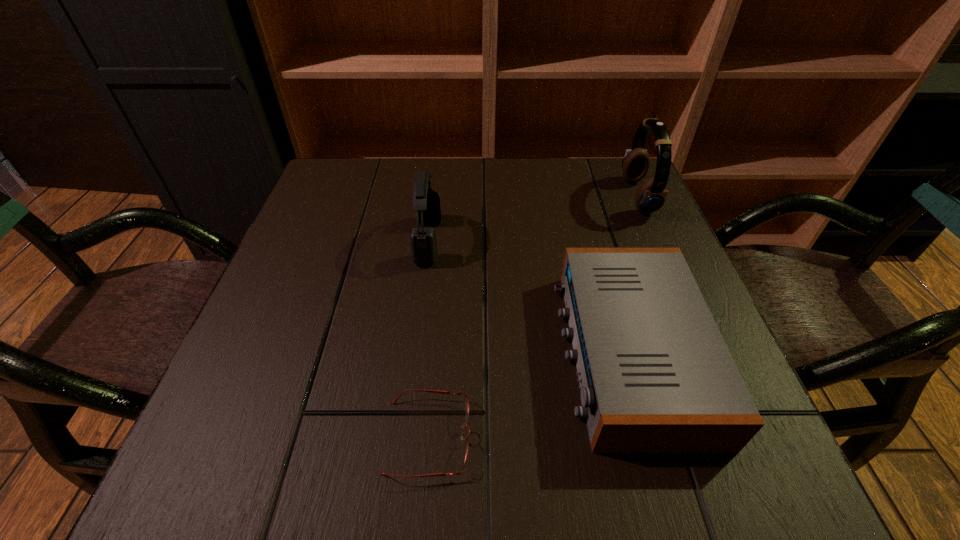
Locate an element on the screen. This screenshot has width=960, height=540. the taller headset is located at coordinates (651, 195).

Identify the location of the right headset. (651, 195).

I want to click on the shorter headset, so click(x=426, y=202).

The width and height of the screenshot is (960, 540). I want to click on the left headset, so click(x=426, y=202).

The width and height of the screenshot is (960, 540). In order to click on radio receiver in this screenshot , I will do `click(656, 376)`.

Locate an element on the screen. This screenshot has height=540, width=960. the shortest object is located at coordinates (433, 391).

At what (x,y) coordinates should I click in order to perform the action: click on free space located 0.340m on the ear cup of the tallest object. Please return your answer as a coordinate pair (x, y). Image resolution: width=960 pixels, height=540 pixels. Looking at the image, I should click on (485, 197).

This screenshot has width=960, height=540. I want to click on vacant space located 0.400m on the ear cup of the tallest object, so click(460, 197).

Where is `free point located on the ear cup of the tallest object`? Image resolution: width=960 pixels, height=540 pixels. free point located on the ear cup of the tallest object is located at coordinates (580, 197).

This screenshot has height=540, width=960. What are the coordinates of `vacant space situated 0.400m on the headband of the third shortest object` in the screenshot? It's located at (625, 240).